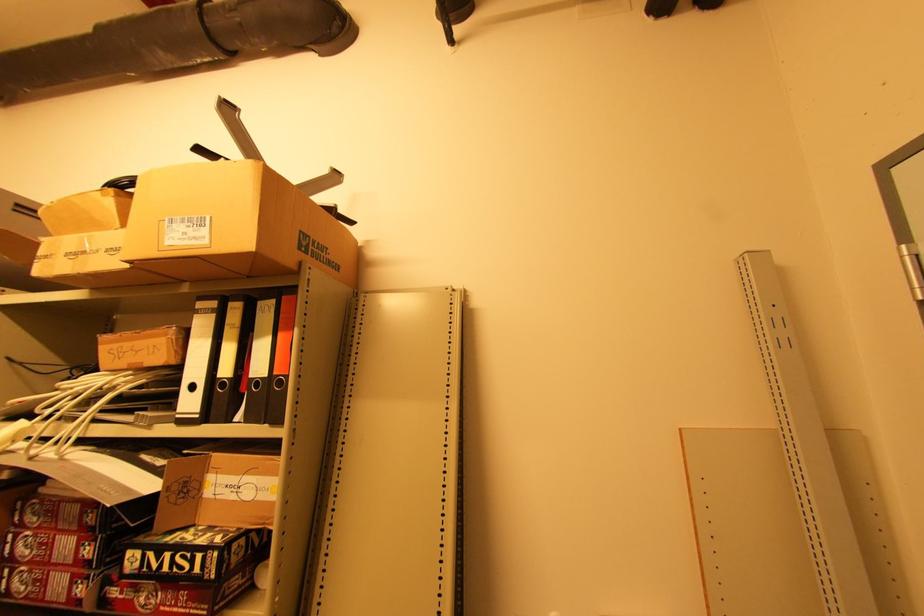
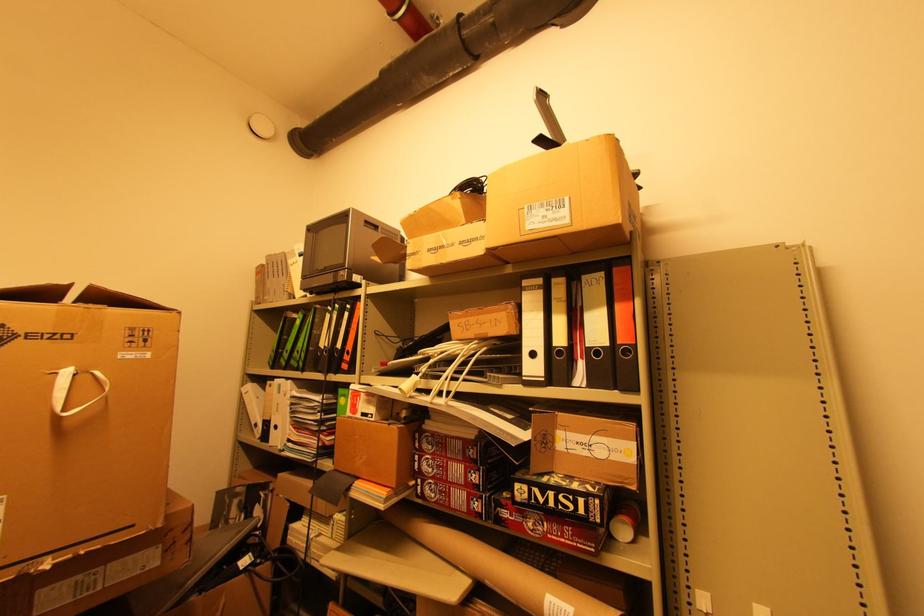
Locate, in the second image, the point that corresponds to point 202,61 in the first image.

(455, 75)